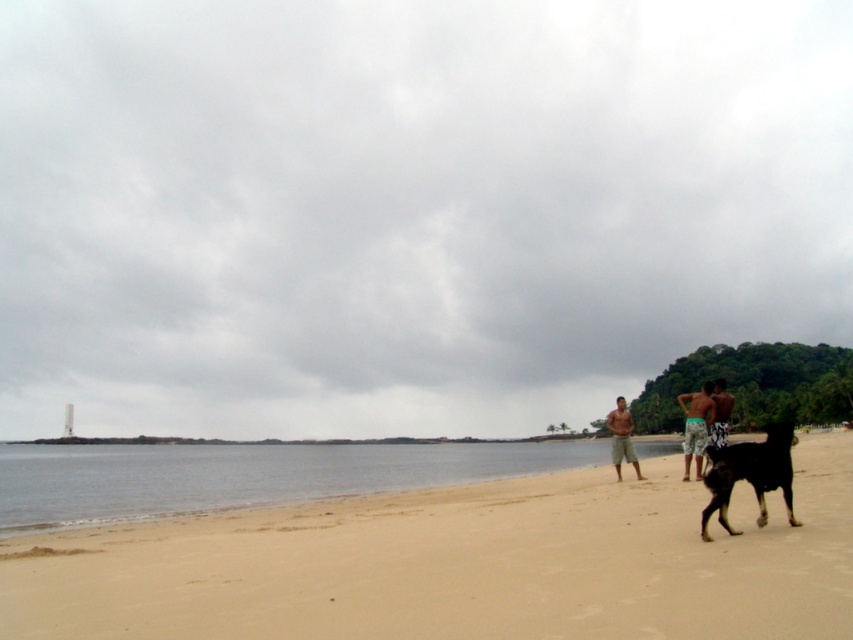
Question: Is clear water at lower left above tan shorts at center?

Choices:
 (A) no
 (B) yes

Answer: (A)

Question: Does sandy beach at lower center have a larger size compared to clear water at lower left?

Choices:
 (A) no
 (B) yes

Answer: (A)

Question: Which point appears farthest from the camera in this image?

Choices:
 (A) (611, 449)
 (B) (764, 468)
 (C) (125, 465)
 (D) (572, 531)

Answer: (C)

Question: Can you confirm if black glossy dog at lower right is positioned above camouflage shorts at right?

Choices:
 (A) no
 (B) yes

Answer: (B)

Question: Which object is positioned closest to the sandy beach at lower center?

Choices:
 (A) black glossy dog at lower right
 (B) clear water at lower left
 (C) camouflage shorts at right
 (D) tan shorts at center

Answer: (A)

Question: Which of the following is the closest to the observer?

Choices:
 (A) clear water at lower left
 (B) camouflage shorts at right
 (C) sandy beach at lower center

Answer: (C)